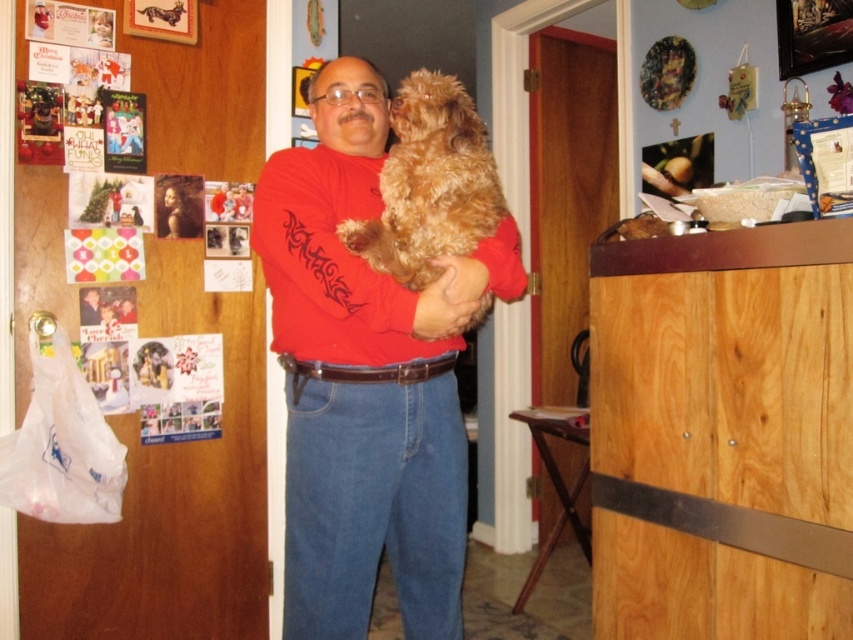
Can you confirm if matte red shirt at center is positioned below fuzzy brown dog at center?

Yes, matte red shirt at center is below fuzzy brown dog at center.

Does point (445, 552) come farther from viewer compared to point (337, 234)?

Yes, point (445, 552) is behind point (337, 234).

The image size is (853, 640). I want to click on matte red shirt at center, so click(x=366, y=378).